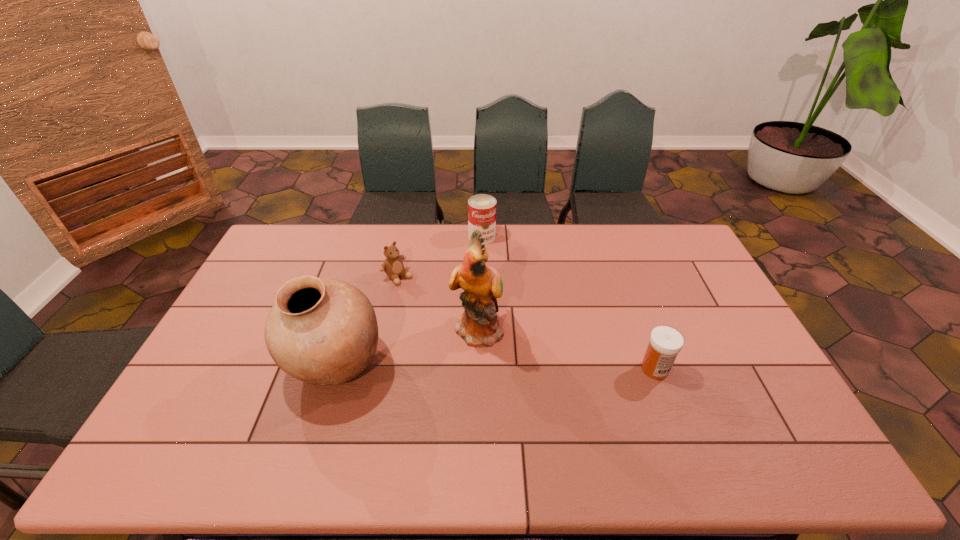
Where is `free spot located on the front-facing side of the teddy bear`? The height and width of the screenshot is (540, 960). free spot located on the front-facing side of the teddy bear is located at coordinates (421, 295).

I want to click on vacant space located on the front-facing side of the parrot, so click(519, 363).

Where is `free space located 0.320m on the front-facing side of the parrot`? free space located 0.320m on the front-facing side of the parrot is located at coordinates (586, 415).

This screenshot has width=960, height=540. Identify the location of free space located 0.370m on the front-facing side of the parrot. (603, 428).

The height and width of the screenshot is (540, 960). I want to click on free spot located 0.400m on the front label of the third tallest object, so click(498, 321).

Identify the location of vacant region located on the front label of the third tallest object. (495, 306).

Identify the location of vacant space located on the front label of the third tallest object. The height and width of the screenshot is (540, 960). (487, 259).

Find the location of a particular element. object that is at the far edge is located at coordinates (481, 208).

What are the coordinates of `object situated at the near edge` in the screenshot? It's located at (323, 332).

At what (x,y) coordinates should I click in order to perform the action: click on blank space at the far edge of the desktop. Please return your answer as a coordinate pair (x, y). This screenshot has width=960, height=540. Looking at the image, I should click on (618, 228).